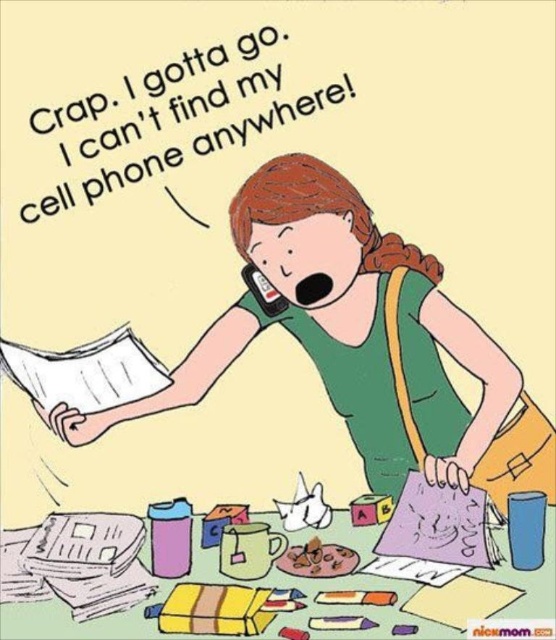
Does green fabric shirt at center have a lesser height compared to matte black phone at mouth?

In fact, green fabric shirt at center may be taller than matte black phone at mouth.

Looking at this image, can you confirm if green fabric shirt at center is positioned above matte black phone at mouth?

Incorrect, green fabric shirt at center is not positioned above matte black phone at mouth.

Is point (249, 340) positioned behind point (242, 276)?

Yes, it is behind point (242, 276).

At what (x,y) coordinates should I click in order to perform the action: click on green fabric shirt at center. Please return your answer as a coordinate pair (x, y). Image resolution: width=556 pixels, height=640 pixels. Looking at the image, I should click on (371, 312).